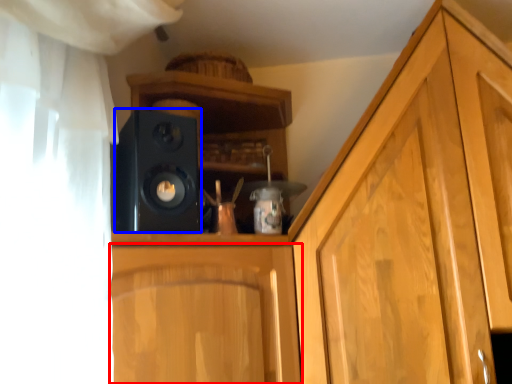
Question: Which object appears farthest to the camera in this image, cabinetry (highlighted by a red box) or speaker (highlighted by a blue box)?

Choices:
 (A) cabinetry
 (B) speaker

Answer: (B)